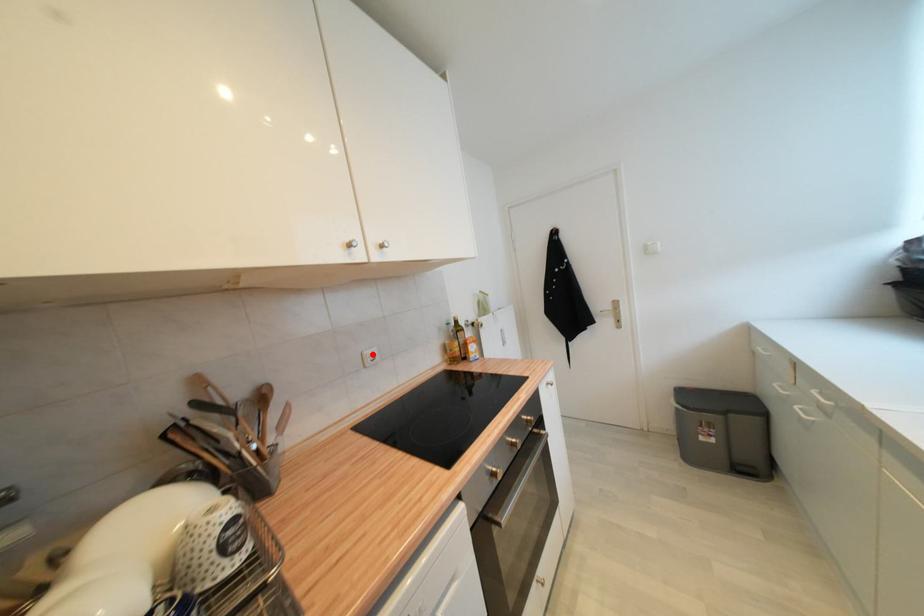
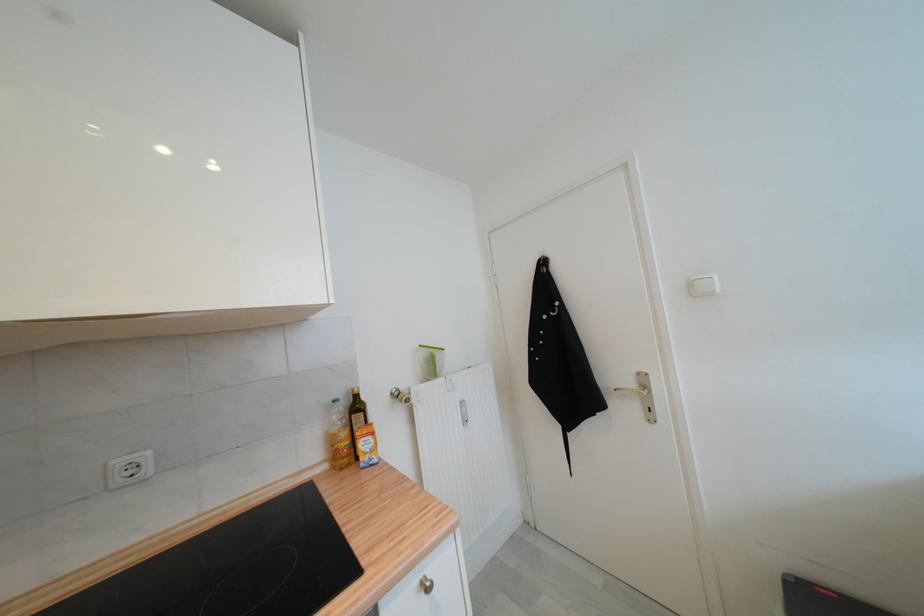
The point at the highlighted location is marked in the first image. Where is the corresponding point in the second image?

(126, 464)